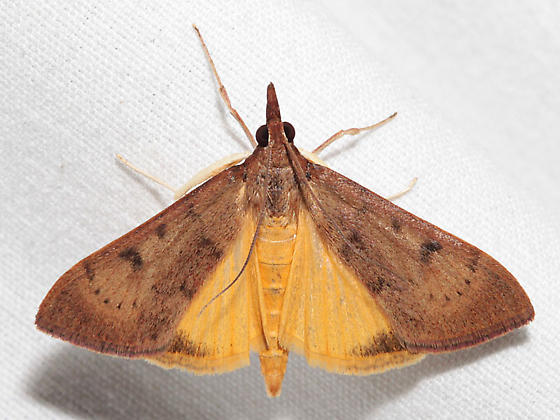
Where is `possible paper towel`? The width and height of the screenshot is (560, 420). possible paper towel is located at coordinates (151, 98).